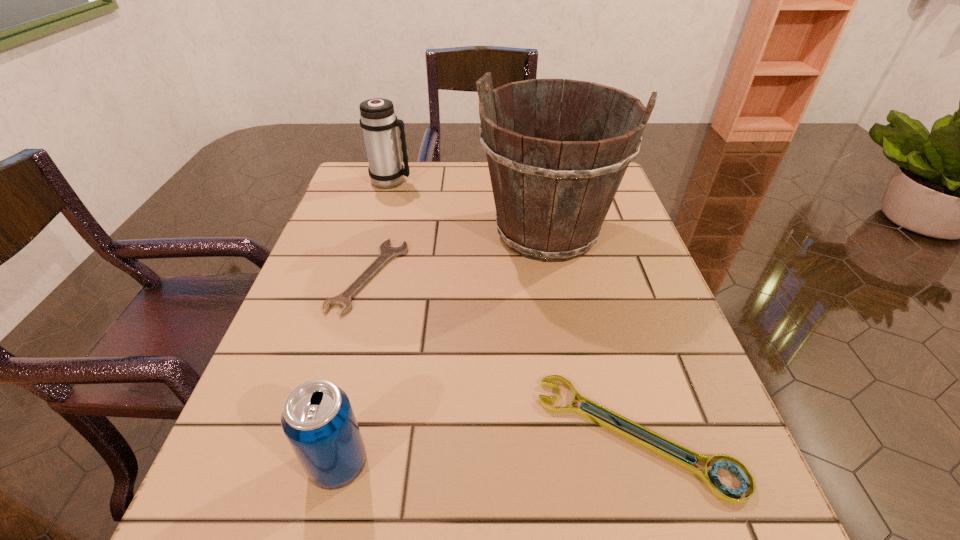
Where is `free space located 0.280m on the right of the farther wrench`? This screenshot has width=960, height=540. free space located 0.280m on the right of the farther wrench is located at coordinates (537, 276).

You are a GUI agent. You are given a task and a screenshot of the screen. Output one action in this format:
    pyautogui.click(x=<x>, y=<y>)
    Task: Click on the bucket located at the far edge
    Image resolution: width=960 pixels, height=540 pixels.
    Given the screenshot: What is the action you would take?
    pyautogui.click(x=552, y=195)

Image resolution: width=960 pixels, height=540 pixels. Find the location of `thermos bottle present at the far edge`. thermos bottle present at the far edge is located at coordinates (378, 120).

Identify the location of object that is at the near edge. This screenshot has height=540, width=960. (719, 490).

I want to click on thermos bottle that is at the left edge, so click(x=378, y=120).

Identify the location of pop soda located at the left edge. The image size is (960, 540). (317, 418).

This screenshot has height=540, width=960. I want to click on wrench present at the left edge, so click(x=343, y=300).

Find the location of a particular element. The width and height of the screenshot is (960, 540). bucket situated at the right edge is located at coordinates (552, 195).

Locate an element on the screen. This screenshot has height=540, width=960. wrench present at the right edge is located at coordinates (719, 490).

At what (x,y) coordinates should I click in order to perform the action: click on object located at the far left corner. Please return your answer as a coordinate pair (x, y). Looking at the image, I should click on (378, 120).